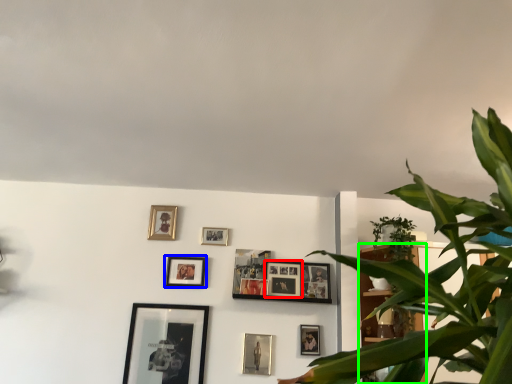
Question: Based on their relative distances, which object is nearer to picture frame (highlighted by a red box)? Choose from picture frame (highlighted by a blue box) and bookshelf (highlighted by a green box).

Choices:
 (A) picture frame
 (B) bookshelf

Answer: (B)